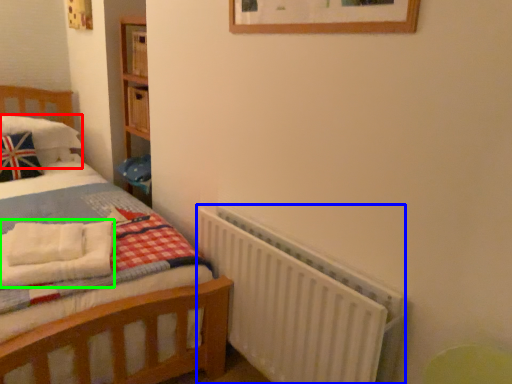
Question: Estimate the real-world distances between objects in this image. Which object is closer to pillow (highlighted by a red box), radiator (highlighted by a blue box) or blanket (highlighted by a green box)?

Choices:
 (A) radiator
 (B) blanket

Answer: (B)